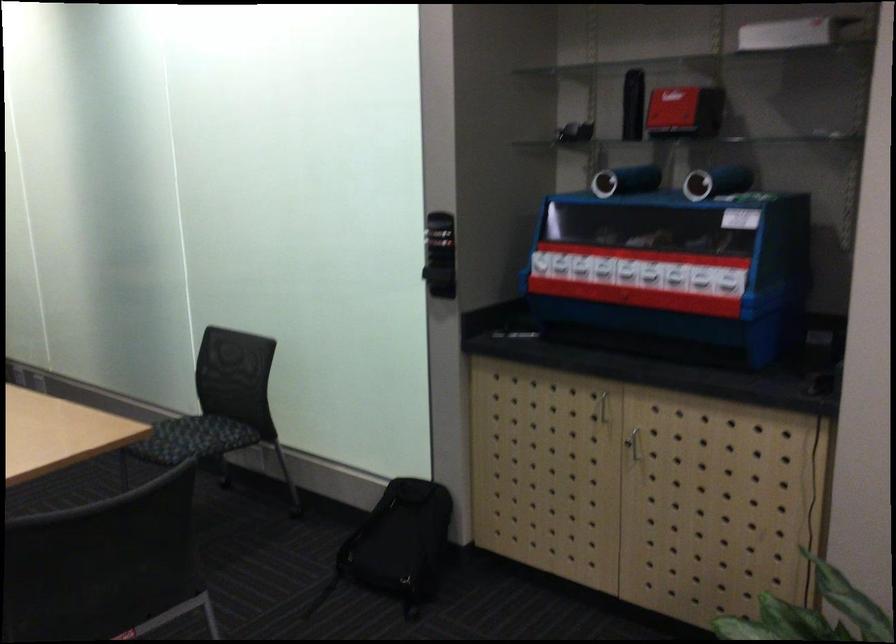
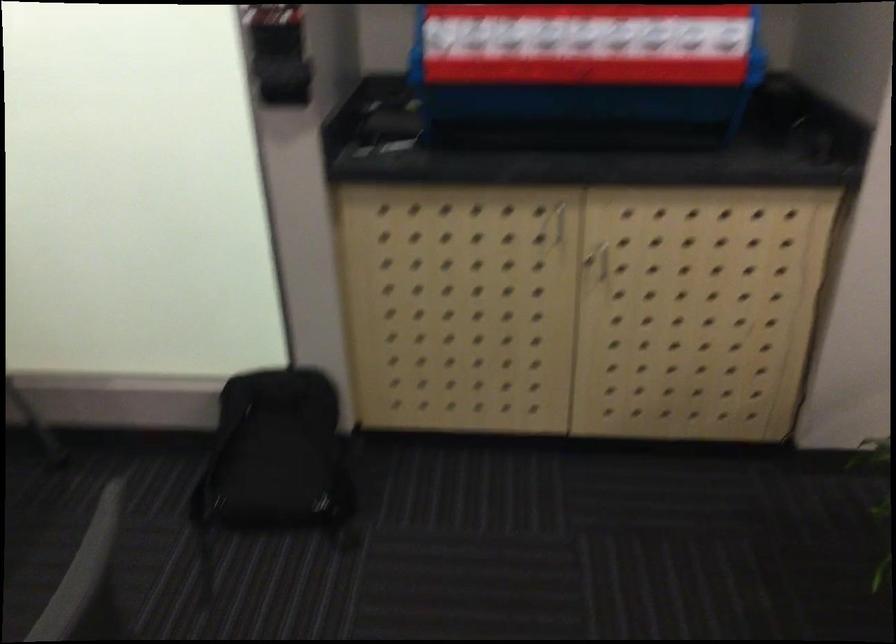
Locate, in the second image, the point that corresponds to the point at 395,536 in the first image.

(277, 455)